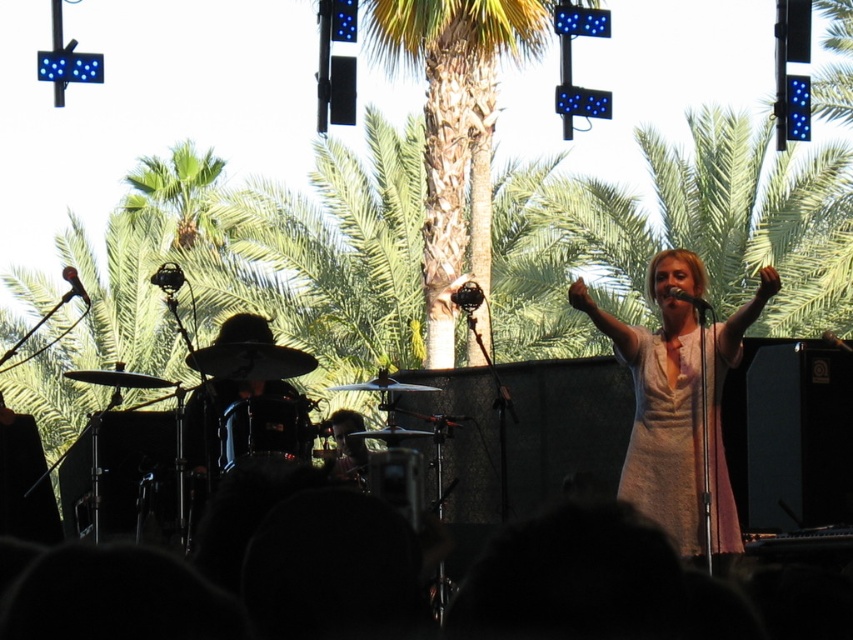
Between white satin dress at center and black matte microphone at center, which one appears on the right side from the viewer's perspective?

black matte microphone at center

Does white satin dress at center appear over black matte microphone at center?

Actually, white satin dress at center is below black matte microphone at center.

This screenshot has width=853, height=640. Describe the element at coordinates (662, 397) in the screenshot. I see `white satin dress at center` at that location.

I want to click on white satin dress at center, so click(662, 397).

Does silhouette heads at lower center have a greater height compared to white satin dress at center?

Incorrect, silhouette heads at lower center's height is not larger of white satin dress at center's.

Who is higher up, silhouette heads at lower center or white satin dress at center?

white satin dress at center is higher up.

The height and width of the screenshot is (640, 853). Identify the location of silhouette heads at lower center. coord(241,582).

Is point (672, 352) behind point (65, 266)?

No.

Is white satin dress at center wider than black matte microphone at upper left?

No.

Which is behind, point (598, 320) or point (73, 292)?

Positioned behind is point (598, 320).

This screenshot has height=640, width=853. What are the coordinates of `white satin dress at center` in the screenshot? It's located at (662, 397).